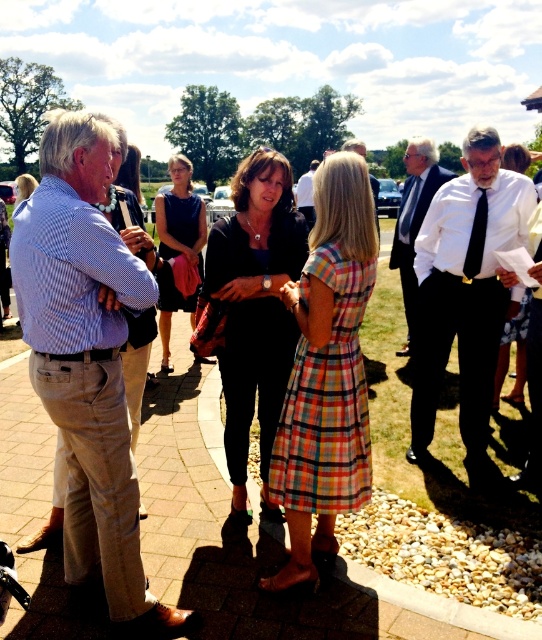
You are standing in the garden party scene. There are two points marked in the image. The first point is at coordinate point [416,140] and the second point is at coordinate point [308,184]. Which point is closer to you?

Point [416,140] is closer to the viewer than point [308,184].

In the scene shown: You are a photographer trying to capture a group photo of the light blue checkered shirt at left and the light brown leather shoes at center. Since you want to ensure both subjects are clearly visible, which subject should you focus on to avoid blurriness if the camera has limited depth of field?

The light blue checkered shirt at left has a smaller width than the light brown leather shoes at center. To ensure both are in focus, prioritize focusing on the closer subject, but since the description only mentions size, not distance, you might need to adjust the camera settings for a deeper depth of field.